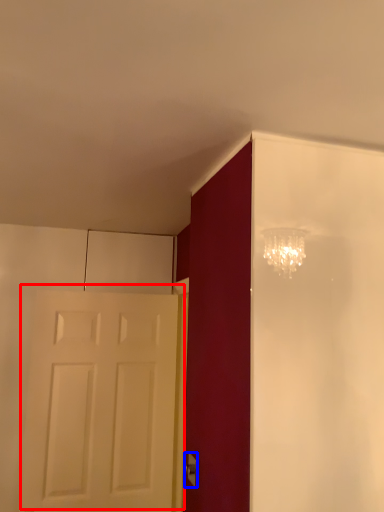
Question: Which object appears closest to the camera in this image, door (highlighted by a red box) or door handle (highlighted by a blue box)?

Choices:
 (A) door
 (B) door handle

Answer: (B)